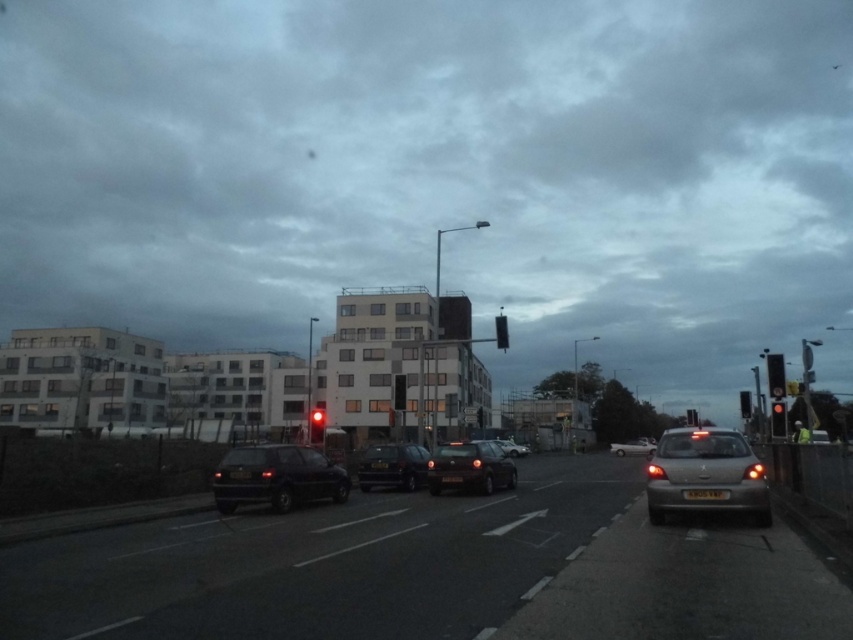
You are a pedestrian standing at the crosswalk and want to cross the street. There is a matte black traffic light at center and a matte black sedan at center in front of you. Which object is closer to your left side?

The matte black traffic light at center is positioned on the left side of the matte black sedan at center, so the traffic light is closer to your left side.